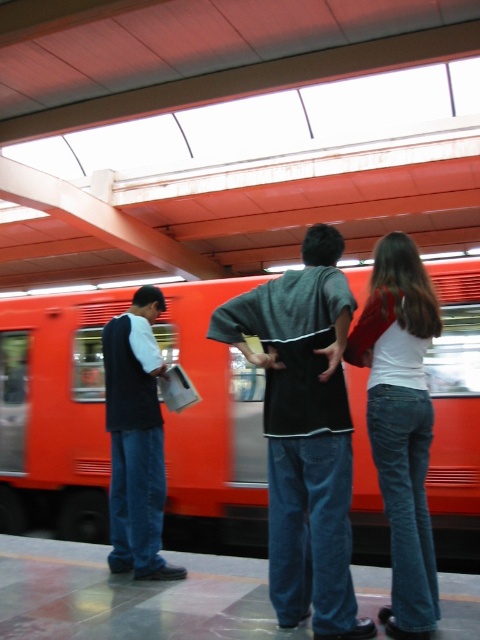
Question: Which point is farther to the camera?

Choices:
 (A) (330, 234)
 (B) (144, 385)
 (C) (431, 308)
 (D) (0, 376)

Answer: (D)

Question: Is orange metallic train at center wider than dark blue jeans at left?

Choices:
 (A) no
 (B) yes

Answer: (A)

Question: Can you confirm if orange metallic train at center is smaller than dark gray cotton shirt at center?

Choices:
 (A) no
 (B) yes

Answer: (B)

Question: Is white matte shirt at center above dark blue jeans at left?

Choices:
 (A) no
 (B) yes

Answer: (B)

Question: Which of the following is the farthest from the observer?

Choices:
 (A) dark blue jeans at left
 (B) orange metallic train at center
 (C) white matte shirt at center

Answer: (B)

Question: Which object is closer to the camera taking this photo?

Choices:
 (A) white matte shirt at center
 (B) orange metallic train at center

Answer: (A)